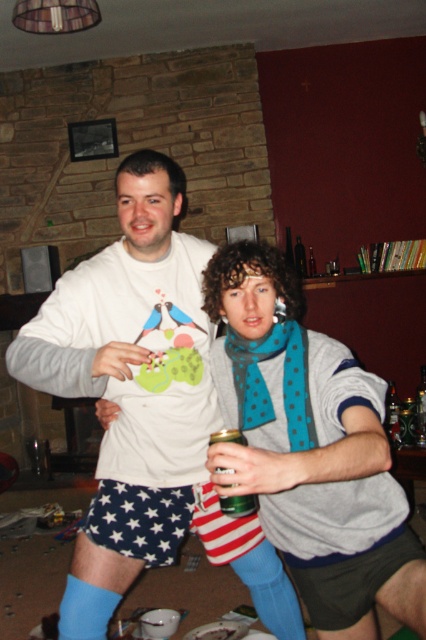
Question: Observing the image, what is the correct spatial positioning of white matte sweatshirt at center in reference to teal dotted scarf at center?

Choices:
 (A) below
 (B) above

Answer: (A)

Question: Which of the following is the farthest from the observer?

Choices:
 (A) teal dotted scarf at center
 (B) green glass can at center
 (C) white matte sweatshirt at center

Answer: (A)

Question: Can you confirm if white matte sweatshirt at center is wider than green glass can at center?

Choices:
 (A) yes
 (B) no

Answer: (A)

Question: Among these objects, which one is nearest to the camera?

Choices:
 (A) white matte sweatshirt at center
 (B) green glass can at center

Answer: (B)

Question: In this image, where is white matte sweatshirt at center located relative to teal dotted scarf at center?

Choices:
 (A) right
 (B) left

Answer: (B)

Question: Which object is positioned closest to the white matte sweatshirt at center?

Choices:
 (A) green glass can at center
 (B) teal dotted scarf at center

Answer: (B)